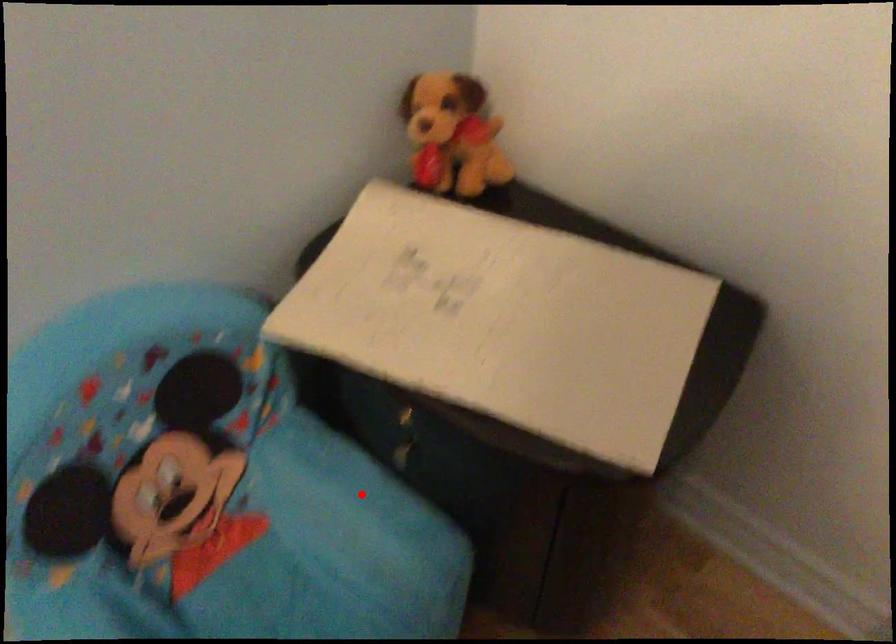
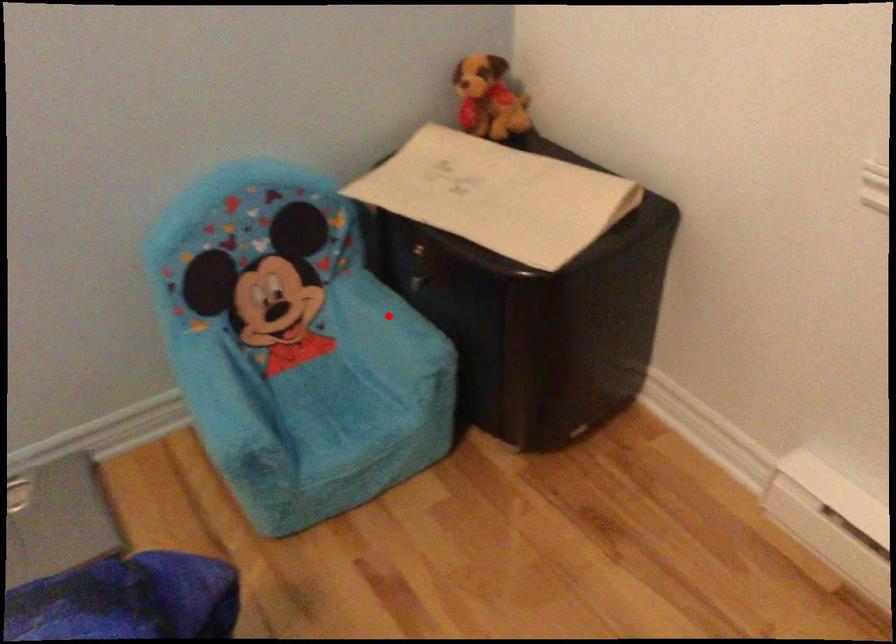
I am providing you with two images of the same scene from different viewpoints. A red point is marked on the first image and another point is marked on the second image. Is the red point in image1 aligned with the point shown in image2?

Yes